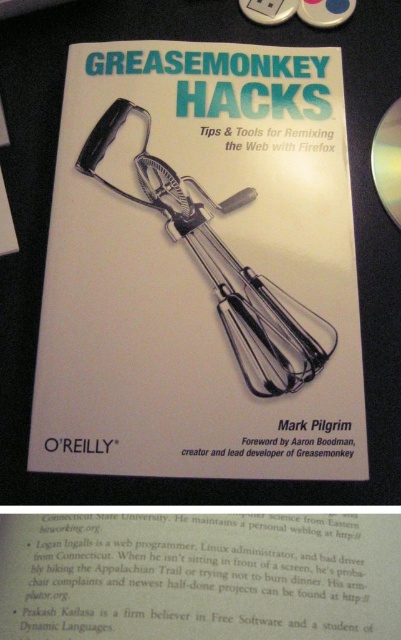
Based on the photo, you are a librarian organizing books and DVDs. You need to place the white paper book at center and the silver metallic dvd at upper right on a shelf. The shelf has a minimum required distance of 8 inches between items for easy access. Can you place them as they are?

The distance between the white paper book at center and the silver metallic dvd at upper right is 8.84 inches, which exceeds the minimum required distance of 8 inches. Therefore, they can be placed as they are.

You are organizing a library shelf and need to place both the white paper book at center and the silver metallic dvd at upper right. Since the shelf has limited vertical space, which item should you place first to ensure both fit vertically?

The white paper book at center is taller than the silver metallic dvd at upper right. To ensure both fit vertically, place the taller white paper book at center first and then position the shorter silver metallic dvd at upper right above or below it accordingly.

What are the coordinates of the white paper book at center?

The white paper book at center is located at point (200,268).